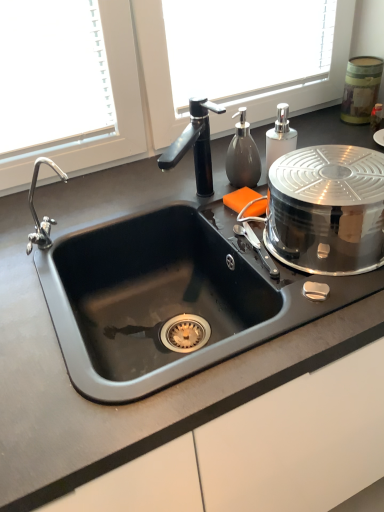
The width and height of the screenshot is (384, 512). Find the location of `free point to the left of white glossy soap dispenser at upper right, arranged as the first soap dispenser when viewed from the right`. free point to the left of white glossy soap dispenser at upper right, arranged as the first soap dispenser when viewed from the right is located at coordinates (219, 192).